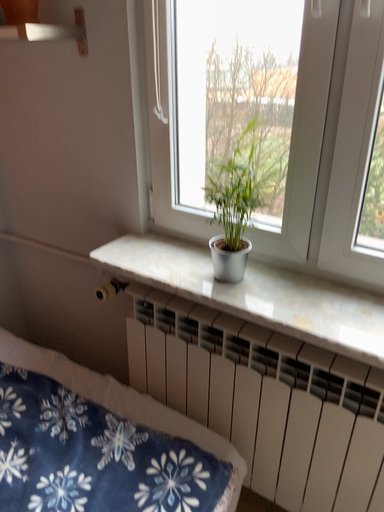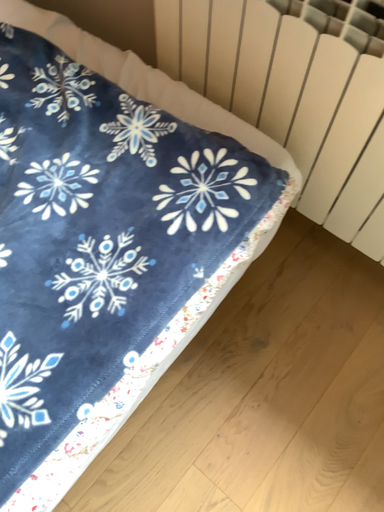
Question: How did the camera likely rotate when shooting the video?

Choices:
 (A) rotated left
 (B) rotated right

Answer: (A)